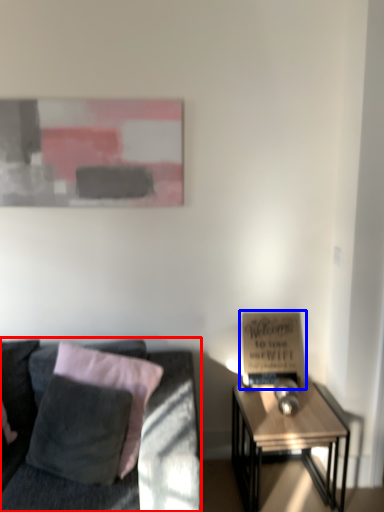
Question: Which object is further to the camera taking this photo, studio couch (highlighted by a red box) or bulletin board (highlighted by a blue box)?

Choices:
 (A) studio couch
 (B) bulletin board

Answer: (B)